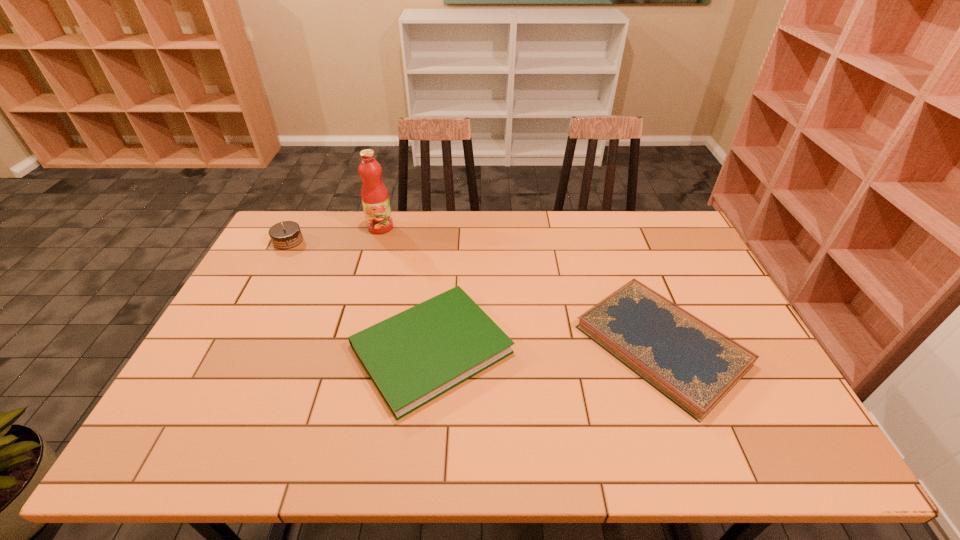
Where is `free space between the leftmost object and the fruit juice`? This screenshot has height=540, width=960. free space between the leftmost object and the fruit juice is located at coordinates (334, 234).

Where is `free spot between the chocolate cake and the left paperback book`? free spot between the chocolate cake and the left paperback book is located at coordinates (360, 295).

Identify the location of free space between the tallest object and the third shortest object. The height and width of the screenshot is (540, 960). (334, 234).

Identify the location of free spot between the fruit juice and the chocolate cake. The height and width of the screenshot is (540, 960). (334, 234).

The image size is (960, 540). Identify the location of free space between the left paperback book and the leftmost object. (360, 295).

Find the location of a particular element. The width and height of the screenshot is (960, 540). free space between the left paperback book and the right paperback book is located at coordinates (546, 347).

Find the location of a particular element. free space between the right paperback book and the tallest object is located at coordinates (520, 286).

Where is `free space between the tallest object and the rightmost object`? free space between the tallest object and the rightmost object is located at coordinates (520, 286).

At what (x,y) coordinates should I click in order to perform the action: click on free space between the left paperback book and the rightmost object. Please return your answer as a coordinate pair (x, y). This screenshot has width=960, height=540. Looking at the image, I should click on (546, 347).

Identify which object is located as the third nearest to the rightmost object. Please provide its 2D coordinates. Your answer should be formatted as a tuple, i.e. [(x, y)], where the tuple contains the x and y coordinates of a point satisfying the conditions above.

[(285, 235)]